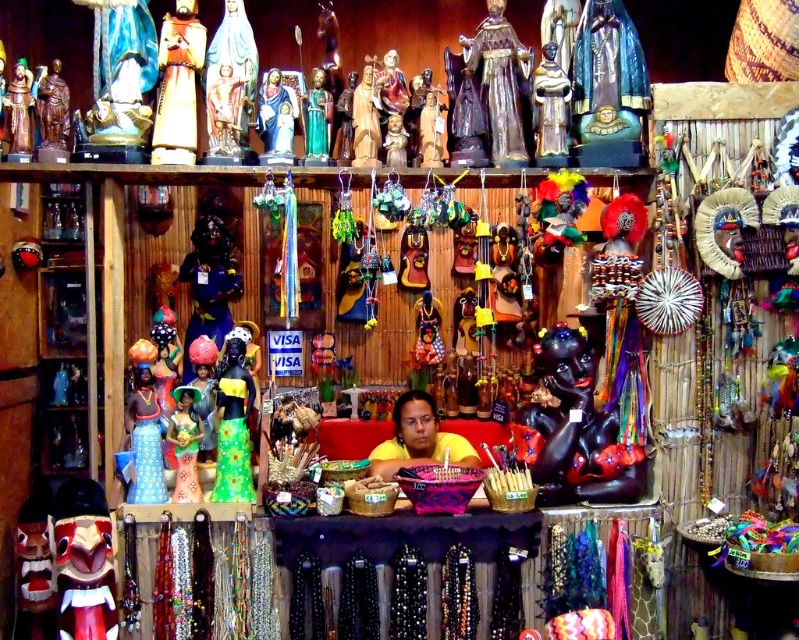
You are standing in front of the market stall and want to locate two specific points mentioned in the scene. Which point is closer to you, point (247, 390) or point (289, 90)?

Point (247, 390) is in front of point (289, 90), so it is closer to you.

You are a customer at the market stall and want to buy an item that can be easily carried in your pocket. Which item between the multicolored beaded necklaces at center and the shiny gold statue at upper center would you choose?

The shiny gold statue at upper center has a smaller size compared to the multicolored beaded necklaces at center, so it would be easier to carry in your pocket.